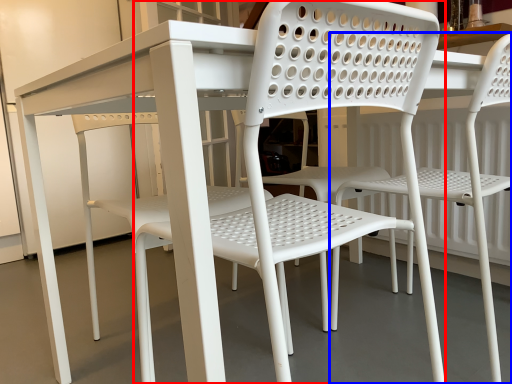
Question: Which of the following is the farthest to the observer, chair (highlighted by a red box) or chair (highlighted by a blue box)?

Choices:
 (A) chair
 (B) chair

Answer: (B)